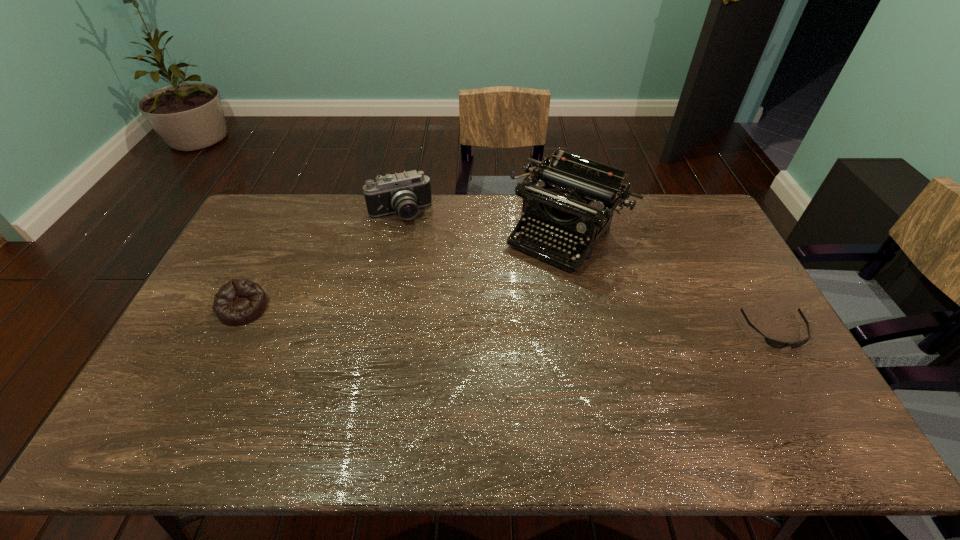
The image size is (960, 540). Find the location of `free location located on the keyboard of the third object from left to right`. free location located on the keyboard of the third object from left to right is located at coordinates (502, 313).

At what (x,y) coordinates should I click in order to perform the action: click on free space located on the keyboard of the third object from left to right. Please return your answer as a coordinate pair (x, y). The image size is (960, 540). Looking at the image, I should click on (502, 313).

Find the location of a particular element. free space located on the keyboard of the third object from left to right is located at coordinates (488, 332).

In order to click on free space located on the front-facing side of the second object from left to right in this screenshot , I will do `click(440, 305)`.

What are the coordinates of `vacant position located 0.130m on the front-facing side of the second object from left to right` in the screenshot? It's located at (418, 249).

At what (x,y) coordinates should I click in order to perform the action: click on free space located 0.200m on the front-facing side of the second object from left to right. Please return your answer as a coordinate pair (x, y). This screenshot has width=960, height=540. Looking at the image, I should click on (423, 263).

Identify the location of typewriter situated at the far edge. (577, 197).

Identify the location of camera that is at the far edge. The width and height of the screenshot is (960, 540). (403, 193).

Locate an element on the screen. The height and width of the screenshot is (540, 960). object positioned at the left edge is located at coordinates (239, 301).

Locate an element on the screen. The image size is (960, 540). object present at the right edge is located at coordinates (777, 344).